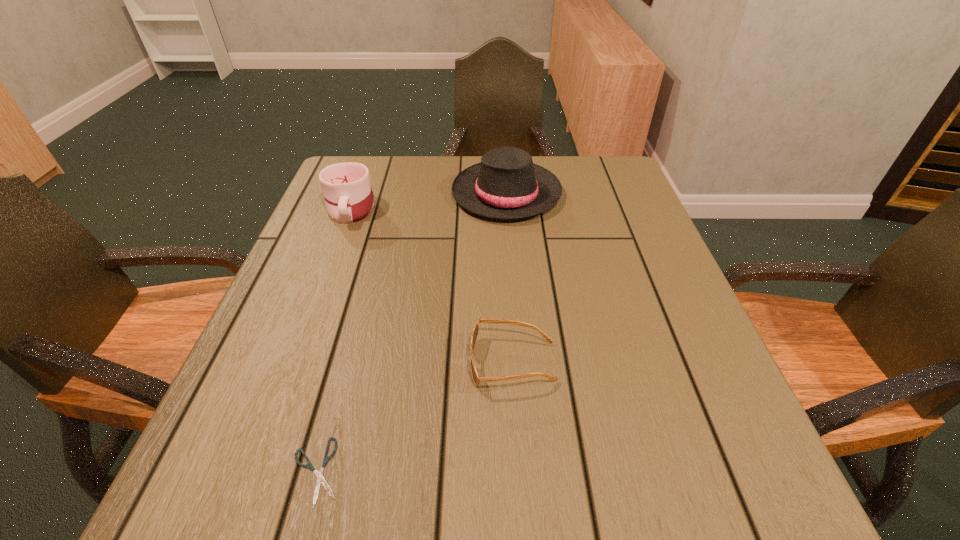
The height and width of the screenshot is (540, 960). I want to click on vacant area that lies between the shortest object and the dress hat, so click(x=411, y=332).

In order to click on vacant space that is in between the shears and the dress hat in this screenshot , I will do `click(411, 332)`.

Find the location of a particular element. The height and width of the screenshot is (540, 960). empty space between the mug and the dress hat is located at coordinates (428, 201).

The image size is (960, 540). I want to click on blank region between the shortest object and the third tallest object, so click(x=415, y=417).

I want to click on empty space between the third tallest object and the dress hat, so click(510, 278).

Where is `the third closest object to the mug`? This screenshot has height=540, width=960. the third closest object to the mug is located at coordinates (320, 479).

Locate an element on the screen. Image resolution: width=960 pixels, height=540 pixels. object that stands as the second closest to the nearest object is located at coordinates (348, 194).

Where is `vacant region that satisfies the following two spatial constraints: 1. on the side with the handle of the mug; 2. on the right side of the shortest object`? This screenshot has width=960, height=540. vacant region that satisfies the following two spatial constraints: 1. on the side with the handle of the mug; 2. on the right side of the shortest object is located at coordinates (252, 471).

You are a GUI agent. You are given a task and a screenshot of the screen. Output one action in this format:
    pyautogui.click(x=<x>, y=<y>)
    Task: Click on the free space that satisfies the following two spatial constraints: 1. on the front-facing side of the second nearest object; 2. on the front side of the shortest object
    The height and width of the screenshot is (540, 960).
    Given the screenshot: What is the action you would take?
    pyautogui.click(x=520, y=471)

I want to click on free space that satisfies the following two spatial constraints: 1. on the side with the handle of the shears; 2. on the left side of the mug, so click(x=252, y=471).